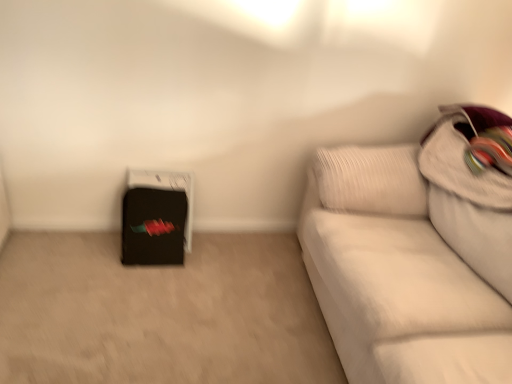
Question: Would you say black matte suitcase at lower left is part of white textured pillow at upper right's contents?

Choices:
 (A) yes
 (B) no

Answer: (B)

Question: From the image's perspective, does white textured pillow at upper right appear higher than black matte suitcase at lower left?

Choices:
 (A) no
 (B) yes

Answer: (B)

Question: From a real-world perspective, is white textured pillow at upper right positioned over black matte suitcase at lower left based on gravity?

Choices:
 (A) yes
 (B) no

Answer: (A)

Question: Is white textured pillow at upper right facing away from black matte suitcase at lower left?

Choices:
 (A) yes
 (B) no

Answer: (B)

Question: From the image's perspective, would you say white textured pillow at upper right is shown under black matte suitcase at lower left?

Choices:
 (A) yes
 (B) no

Answer: (B)

Question: From the image's perspective, relative to black matte suitcase at lower left, is white fabric couch at right above or below?

Choices:
 (A) above
 (B) below

Answer: (B)

Question: Is point (473, 205) closer or farther from the camera than point (170, 241)?

Choices:
 (A) farther
 (B) closer

Answer: (B)

Question: In the image, is white fabric couch at right on the left side or the right side of black matte suitcase at lower left?

Choices:
 (A) left
 (B) right

Answer: (B)

Question: Is white fabric couch at right spatially inside black matte suitcase at lower left, or outside of it?

Choices:
 (A) outside
 (B) inside

Answer: (A)

Question: In terms of height, does white fabric couch at right look taller or shorter compared to white textured pillow at upper right?

Choices:
 (A) short
 (B) tall

Answer: (B)

Question: From the image's perspective, relative to white textured pillow at upper right, is white fabric couch at right above or below?

Choices:
 (A) above
 (B) below

Answer: (B)

Question: Is white fabric couch at right inside the boundaries of white textured pillow at upper right, or outside?

Choices:
 (A) inside
 (B) outside

Answer: (B)

Question: Looking at the image, does white fabric couch at right seem bigger or smaller compared to white textured pillow at upper right?

Choices:
 (A) big
 (B) small

Answer: (A)

Question: Is white textured pillow at upper right wider or thinner than white fabric couch at right?

Choices:
 (A) thin
 (B) wide

Answer: (A)

Question: Is white textured pillow at upper right inside the boundaries of white fabric couch at right, or outside?

Choices:
 (A) outside
 (B) inside

Answer: (B)